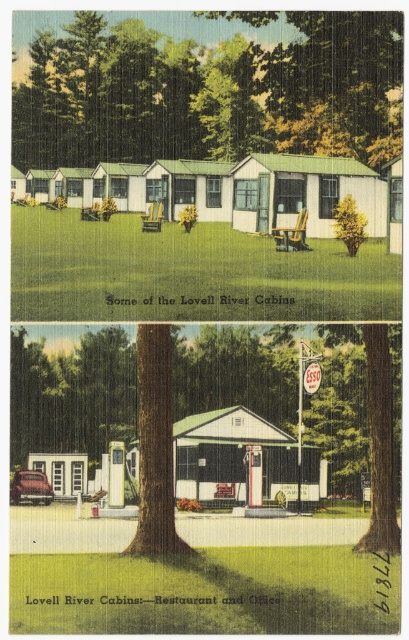
Describe the element at coordinates (217, 428) in the screenshot. I see `green textured tree at center` at that location.

Does green textured tree at center have a larger size compared to green leafy tree at upper center?

No.

Between point (233, 353) and point (103, 42), which one is positioned in front?

Positioned in front is point (233, 353).

The height and width of the screenshot is (640, 409). Find the location of `green textured tree at center`. green textured tree at center is located at coordinates (217, 428).